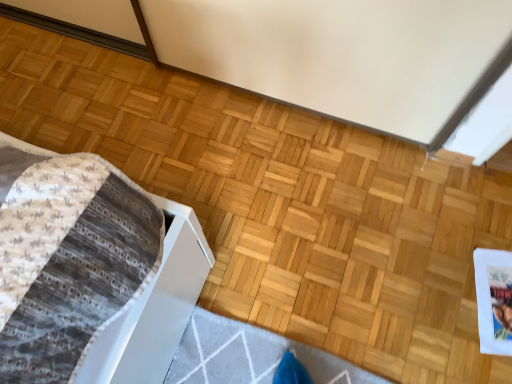
The image size is (512, 384). Identify the location of white paper comic book at lower right. (494, 300).

What do you see at coordinates (494, 300) in the screenshot?
I see `white paper comic book at lower right` at bounding box center [494, 300].

This screenshot has width=512, height=384. I want to click on white paper comic book at lower right, so (x=494, y=300).